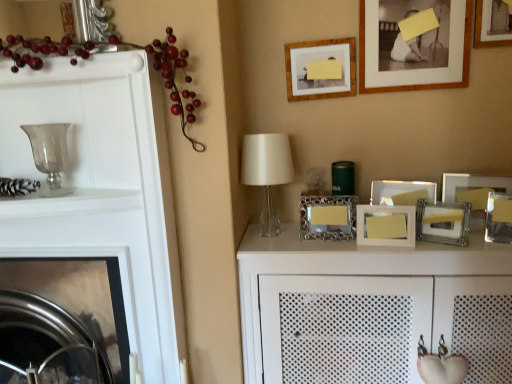
Question: Can we say metallic silver picture frame at right, which appears as the 4th picture frame when ordered from the bottom, lies outside metallic silver picture frame at center-right, which is the fourth picture frame in top-to-bottom order?

Choices:
 (A) no
 (B) yes

Answer: (B)

Question: Can you confirm if metallic silver picture frame at right, which appears as the 4th picture frame when ordered from the bottom, is positioned to the left of metallic silver picture frame at center-right, the sixth picture frame ordered from the bottom?

Choices:
 (A) no
 (B) yes

Answer: (A)

Question: Considering the relative sizes of metallic silver picture frame at right, which appears as the 4th picture frame when ordered from the bottom, and metallic silver picture frame at center-right, which is the fourth picture frame in top-to-bottom order, in the image provided, is metallic silver picture frame at right, which appears as the 4th picture frame when ordered from the bottom, smaller than metallic silver picture frame at center-right, which is the fourth picture frame in top-to-bottom order,?

Choices:
 (A) no
 (B) yes

Answer: (B)

Question: Is there a large distance between metallic silver picture frame at right, the sixth picture frame viewed from the top, and metallic silver picture frame at center-right, the sixth picture frame ordered from the bottom?

Choices:
 (A) yes
 (B) no

Answer: (B)

Question: From a real-world perspective, is metallic silver picture frame at right, which appears as the 4th picture frame when ordered from the bottom, located beneath metallic silver picture frame at center-right, the sixth picture frame ordered from the bottom?

Choices:
 (A) yes
 (B) no

Answer: (A)

Question: Based on their positions, is metallic silver fireplace at left located to the left or right of white textured cabinet at center?

Choices:
 (A) left
 (B) right

Answer: (A)

Question: Would you say metallic silver fireplace at left is inside or outside white textured cabinet at center?

Choices:
 (A) outside
 (B) inside

Answer: (A)

Question: In the image, is metallic silver fireplace at left positioned in front of or behind white textured cabinet at center?

Choices:
 (A) front
 (B) behind

Answer: (B)

Question: From the image's perspective, is metallic silver fireplace at left above or below white textured cabinet at center?

Choices:
 (A) below
 (B) above

Answer: (A)

Question: Based on their positions, is transparent glass candle holder at left located to the left or right of glossy plastic berries at left?

Choices:
 (A) left
 (B) right

Answer: (A)

Question: Would you say transparent glass candle holder at left is inside or outside glossy plastic berries at left?

Choices:
 (A) outside
 (B) inside

Answer: (B)

Question: Based on their sizes in the image, would you say transparent glass candle holder at left is bigger or smaller than glossy plastic berries at left?

Choices:
 (A) small
 (B) big

Answer: (A)

Question: From a real-world perspective, is transparent glass candle holder at left physically located above or below glossy plastic berries at left?

Choices:
 (A) above
 (B) below

Answer: (B)

Question: Is wooden picture frame at upper right, positioned as the first picture frame in top-to-bottom order, wider or thinner than wooden picture frame at center-right, the 9th picture frame from the top?

Choices:
 (A) thin
 (B) wide

Answer: (B)

Question: Considering the positions of wooden picture frame at upper right, placed as the ninth picture frame when sorted from bottom to top, and wooden picture frame at center-right, which is the first picture frame in bottom-to-top order, in the image, is wooden picture frame at upper right, placed as the ninth picture frame when sorted from bottom to top, taller or shorter than wooden picture frame at center-right, which is the first picture frame in bottom-to-top order,?

Choices:
 (A) short
 (B) tall

Answer: (B)